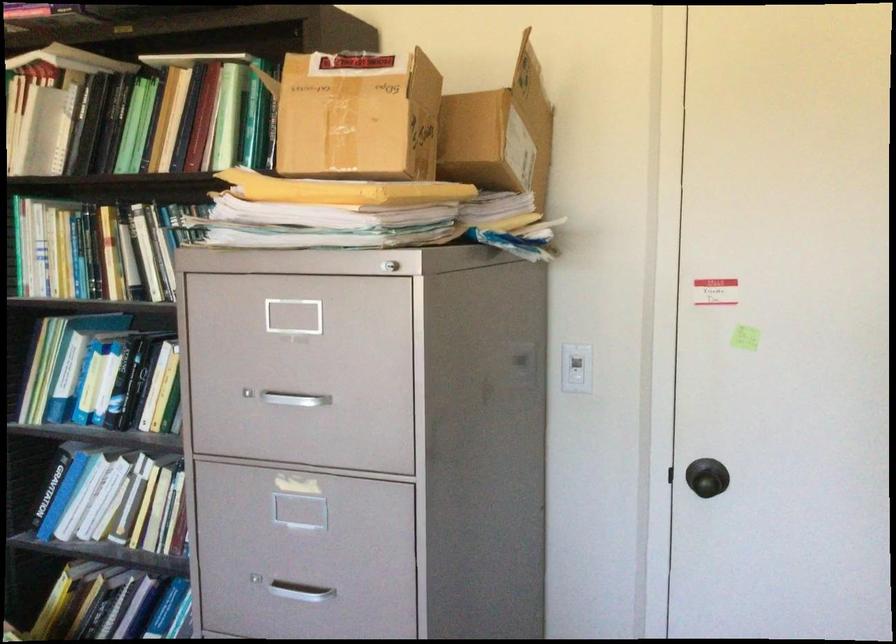
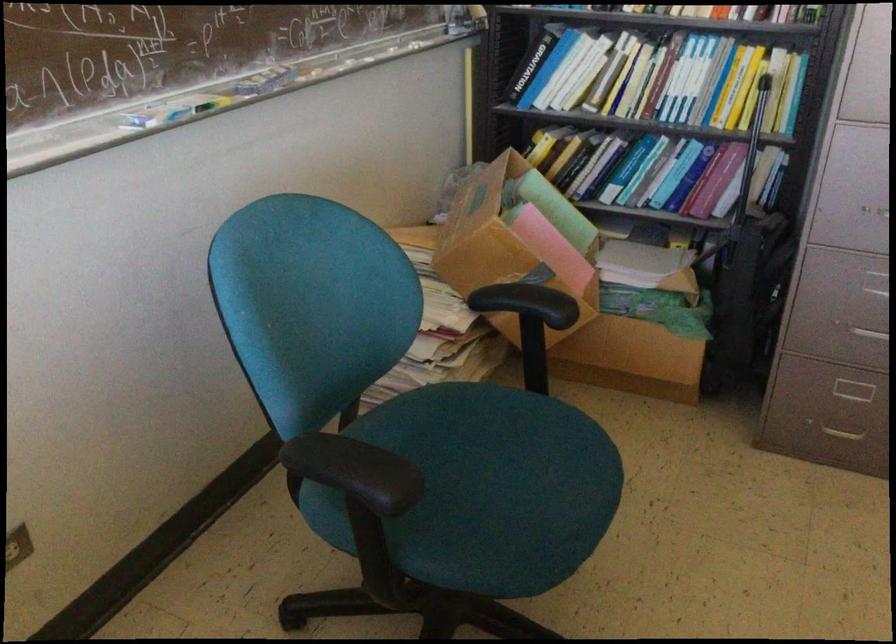
Where in the second image is the point corresponding to (113,506) from the first image?

(583, 77)